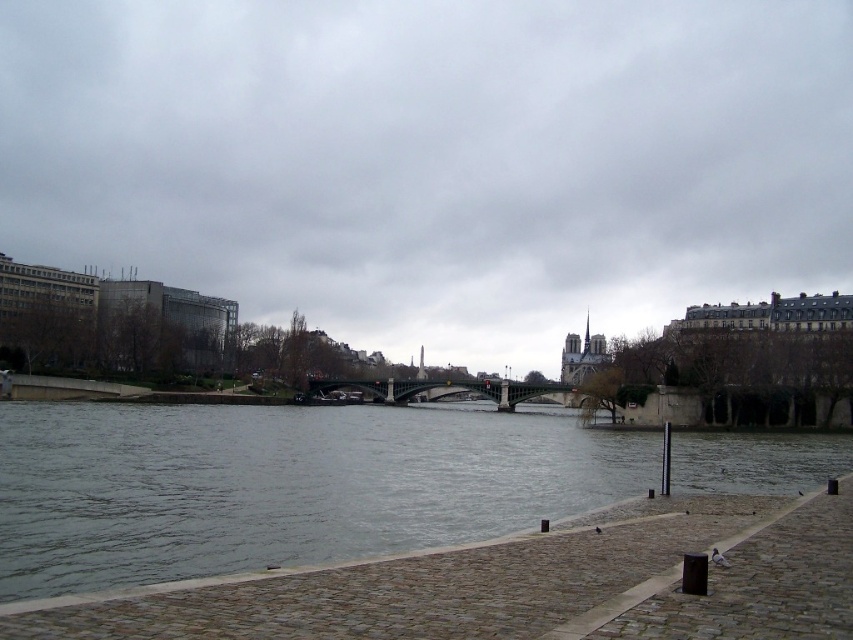
Between cloudy sky at upper center and gray water at center, which one is positioned higher?

cloudy sky at upper center is higher up.

Does cloudy sky at upper center have a greater height compared to gray water at center?

Correct, cloudy sky at upper center is much taller as gray water at center.

Between point (76, 115) and point (833, 442), which one is positioned in front?

Point (833, 442) is more forward.

At what (x,y) coordinates should I click in order to perform the action: click on cloudy sky at upper center. Please return your answer as a coordinate pair (x, y). The width and height of the screenshot is (853, 640). Looking at the image, I should click on (434, 157).

Is gray water at center bigger than green metallic bridge at center?

Yes.

From the picture: Can you confirm if gray water at center is positioned to the left of green metallic bridge at center?

Yes, gray water at center is to the left of green metallic bridge at center.

Measure the distance between gray water at center and camera.

gray water at center is 77.75 feet from camera.

The height and width of the screenshot is (640, 853). What are the coordinates of `gray water at center` in the screenshot? It's located at [281, 484].

Find the location of a particular element. cloudy sky at upper center is located at coordinates (434, 157).

Between cloudy sky at upper center and green metallic bridge at center, which one is positioned lower?

green metallic bridge at center is below.

Who is more distant from viewer, (265, 307) or (485, 394)?

Point (265, 307)

The image size is (853, 640). In order to click on cloudy sky at upper center in this screenshot , I will do `click(434, 157)`.